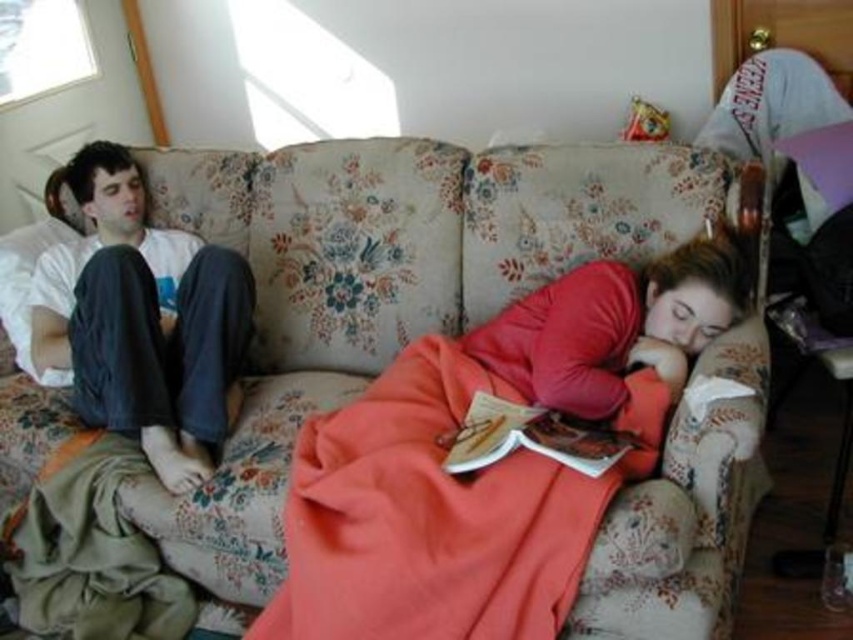
You are a tailor measuring fabrics for a project. You have a white cotton shirt at upper left and a floral fabric couch at center in front of you. Which item requires a taller piece of fabric to cover completely?

The floral fabric couch at center is taller than the white cotton shirt at upper left, so it requires a taller piece of fabric to cover completely.

You are a photographer setting up a shoot in this living room. You need to position a 1.2 meter tall tripod between the white cotton shirt at upper left and the hardcover book at center. Based on their heights, will the tripod be taller than both objects?

The white cotton shirt at upper left is taller than the hardcover book at center. Since the tripod is 1.2 meters tall, it will be taller than both objects if the white cotton shirt at upper left is shorter than 1.2 meters. However, without knowing the exact height of the white cotton shirt at upper left, we cannot definitively determine if the tripod will be taller than both.